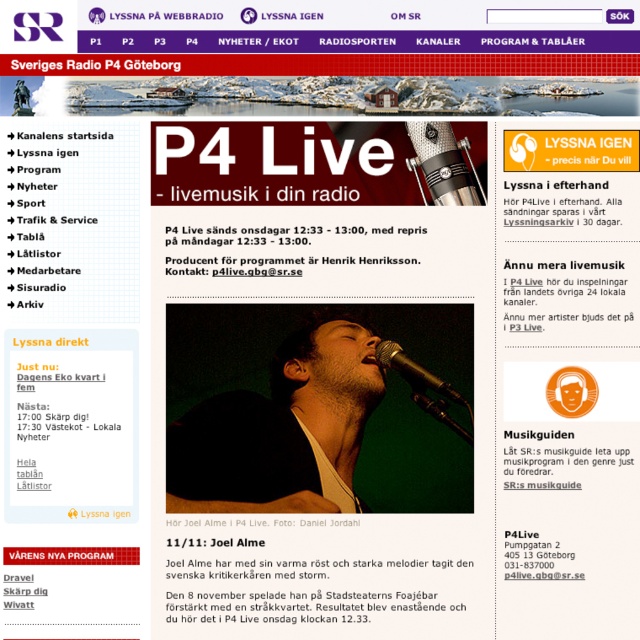
Does silver metallic microphone at center appear under metallic shiny microphone at center?

No, silver metallic microphone at center is not below metallic shiny microphone at center.

Can you confirm if silver metallic microphone at center is smaller than metallic shiny microphone at center?

Indeed, silver metallic microphone at center has a smaller size compared to metallic shiny microphone at center.

Image resolution: width=640 pixels, height=640 pixels. What are the coordinates of `silver metallic microphone at center` in the screenshot? It's located at (442, 164).

Locate an element on the screen. silver metallic microphone at center is located at coordinates (442, 164).

Can you confirm if dark matte jacket at center is positioned below silver metallic microphone at center?

Correct, dark matte jacket at center is located below silver metallic microphone at center.

Is dark matte jacket at center in front of silver metallic microphone at center?

Yes.

Where is `dark matte jacket at center`? dark matte jacket at center is located at coordinates (314, 404).

Can you confirm if dark matte jacket at center is positioned to the right of metallic shiny microphone at center?

Incorrect, dark matte jacket at center is not on the right side of metallic shiny microphone at center.

Locate an element on the screen. Image resolution: width=640 pixels, height=640 pixels. dark matte jacket at center is located at coordinates (314, 404).